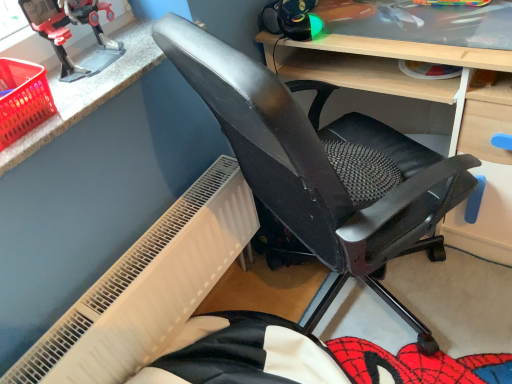
Locate an element on the screen. metallic plastic toy robot at upper left is located at coordinates (71, 34).

Image resolution: width=512 pixels, height=384 pixels. I want to click on matte black chair at center, so click(410, 80).

Where is `black mesh chair at center`? Image resolution: width=512 pixels, height=384 pixels. black mesh chair at center is located at coordinates (321, 164).

Is red plastic basket at upper left bigger than white textured radiator at lower left?

Incorrect, red plastic basket at upper left is not larger than white textured radiator at lower left.

Considering the relative positions of red plastic basket at upper left and white textured radiator at lower left in the image provided, is red plastic basket at upper left to the right of white textured radiator at lower left from the viewer's perspective?

No.

Which of these two, red plastic basket at upper left or white textured radiator at lower left, is thinner?

Thinner between the two is white textured radiator at lower left.

Would you say red plastic basket at upper left contains white textured radiator at lower left?

No, white textured radiator at lower left is located outside of red plastic basket at upper left.

Can you tell me how much red plastic basket at upper left and black mesh chair at center differ in facing direction?

The angular difference between red plastic basket at upper left and black mesh chair at center is 57.2 degrees.

Is point (25, 96) closer or farther from the camera than point (265, 111)?

Point (25, 96) is farther from the camera than point (265, 111).

Is red plastic basket at upper left to the left of black mesh chair at center from the viewer's perspective?

Correct, you'll find red plastic basket at upper left to the left of black mesh chair at center.

Could you tell me if red plastic basket at upper left is facing black mesh chair at center?

No, red plastic basket at upper left is not oriented towards black mesh chair at center.

In the scene shown: From the image's perspective, which object appears higher, matte black chair at center or white textured radiator at lower left?

matte black chair at center is shown above in the image.

Which is closer, (303, 49) or (105, 317)?

Point (303, 49) is farther from the camera than point (105, 317).

Which is more to the left, matte black chair at center or white textured radiator at lower left?

white textured radiator at lower left.

Does matte black chair at center touch white textured radiator at lower left?

They are not placed beside each other.

Considering the sizes of objects white textured radiator at lower left and matte black chair at center in the image provided, who is wider, white textured radiator at lower left or matte black chair at center?

With larger width is matte black chair at center.

Is the depth of white textured radiator at lower left less than that of matte black chair at center?

No, it is behind matte black chair at center.

Is white textured radiator at lower left smaller than matte black chair at center?

Yes, white textured radiator at lower left is smaller than matte black chair at center.

Which is nearer, (189, 267) or (28, 97)?

Point (189, 267) is positioned farther from the camera compared to point (28, 97).

Consider the image. Is the position of white textured radiator at lower left less distant than that of red plastic basket at upper left?

That is False.

Is white textured radiator at lower left thinner than red plastic basket at upper left?

Yes, white textured radiator at lower left is thinner than red plastic basket at upper left.

Identify the location of basket above the white textured radiator at lower left (from a real-world perspective). (22, 99).

Is red plastic basket at upper left to the left of metallic plastic toy robot at upper left from the viewer's perspective?

Indeed, red plastic basket at upper left is positioned on the left side of metallic plastic toy robot at upper left.

Considering the relative sizes of red plastic basket at upper left and metallic plastic toy robot at upper left in the image provided, is red plastic basket at upper left wider than metallic plastic toy robot at upper left?

Yes, red plastic basket at upper left is wider than metallic plastic toy robot at upper left.

Looking at this image, from the image's perspective, is red plastic basket at upper left positioned above or below metallic plastic toy robot at upper left?

From the image's perspective, red plastic basket at upper left appears below metallic plastic toy robot at upper left.

Would you say red plastic basket at upper left is inside or outside metallic plastic toy robot at upper left?

red plastic basket at upper left exists outside the volume of metallic plastic toy robot at upper left.

Locate an element on the screen. This screenshot has width=512, height=384. radiator located underneath the metallic plastic toy robot at upper left (from a real-world perspective) is located at coordinates (148, 287).

Which point is more forward, [98,27] or [161,241]?

Positioned in front is point [98,27].

Who is taller, metallic plastic toy robot at upper left or white textured radiator at lower left?

Standing taller between the two is white textured radiator at lower left.

From the image's perspective, is metallic plastic toy robot at upper left positioned above or below white textured radiator at lower left?

From the image's perspective, metallic plastic toy robot at upper left appears above white textured radiator at lower left.

The width and height of the screenshot is (512, 384). Find the location of `radiator behind the red plastic basket at upper left`. radiator behind the red plastic basket at upper left is located at coordinates (148, 287).

You are a GUI agent. You are given a task and a screenshot of the screen. Output one action in this format:
    pyautogui.click(x=<x>, y=<y>)
    Task: Click on the basket located on the left of black mesh chair at center
    The image size is (512, 384).
    Given the screenshot: What is the action you would take?
    tap(22, 99)

Considering their positions, is red plastic basket at upper left positioned further to metallic plastic toy robot at upper left than white textured radiator at lower left?

Based on the image, white textured radiator at lower left appears to be further to metallic plastic toy robot at upper left.

When comparing their distances from red plastic basket at upper left, does matte black chair at center or metallic plastic toy robot at upper left seem closer?

metallic plastic toy robot at upper left lies closer to red plastic basket at upper left than the other object.

Considering their positions, is red plastic basket at upper left positioned closer to metallic plastic toy robot at upper left than black mesh chair at center?

The object closer to metallic plastic toy robot at upper left is red plastic basket at upper left.

In the scene shown: When comparing their distances from matte black chair at center, does white textured radiator at lower left or black mesh chair at center seem further?

Based on the image, white textured radiator at lower left appears to be further to matte black chair at center.

Looking at the image, which one is located closer to metallic plastic toy robot at upper left, red plastic basket at upper left or matte black chair at center?

red plastic basket at upper left is closer to metallic plastic toy robot at upper left.

From the image, which object appears to be farther from red plastic basket at upper left, black mesh chair at center or matte black chair at center?

matte black chair at center is further to red plastic basket at upper left.

Looking at the image, which one is located further to red plastic basket at upper left, white textured radiator at lower left or black mesh chair at center?

black mesh chair at center is further to red plastic basket at upper left.

Which object lies nearer to the anchor point white textured radiator at lower left, black mesh chair at center or matte black chair at center?

black mesh chair at center lies closer to white textured radiator at lower left than the other object.

Locate an element on the screen. The width and height of the screenshot is (512, 384). basket between metallic plastic toy robot at upper left and white textured radiator at lower left vertically is located at coordinates (22, 99).

At what (x,y) coordinates should I click in order to perform the action: click on chair situated between metallic plastic toy robot at upper left and matte black chair at center from left to right. Please return your answer as a coordinate pair (x, y). The image size is (512, 384). Looking at the image, I should click on (321, 164).

Identify the location of sport equipment between red plastic basket at upper left and black mesh chair at center from left to right. (71, 34).

Where is `sport equipment between red plastic basket at upper left and matte black chair at center in the horizontal direction`? sport equipment between red plastic basket at upper left and matte black chair at center in the horizontal direction is located at coordinates (71, 34).